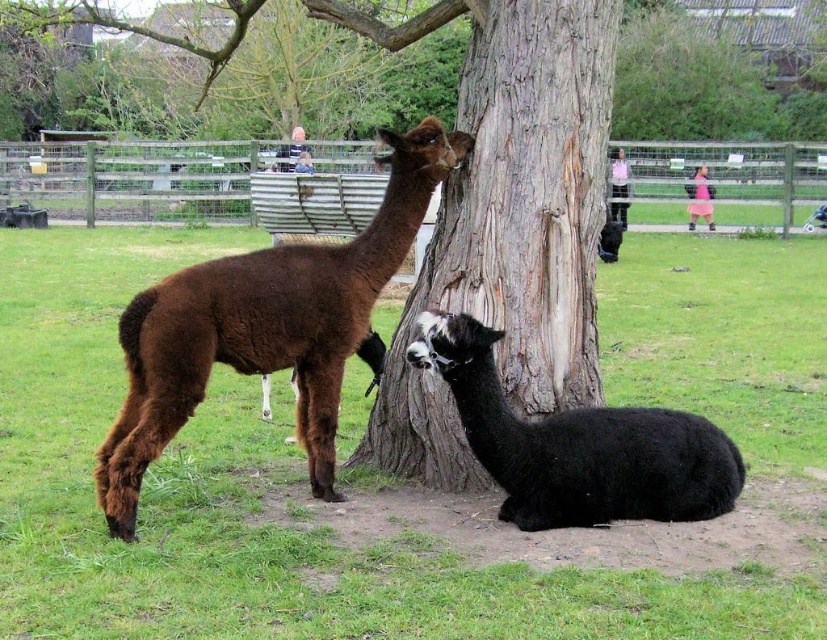
You are a photographer aiming to capture a closeup of the brown rough bark at center while also including the brown woolly alpaca at left in the frame. Based on their positions, will you need to adjust your camera angle to include both subjects?

Yes, you need to adjust your camera angle because the brown rough bark at center is closer to you than the brown woolly alpaca at left, so tilting the camera slightly downward would allow both subjects to be in the frame.